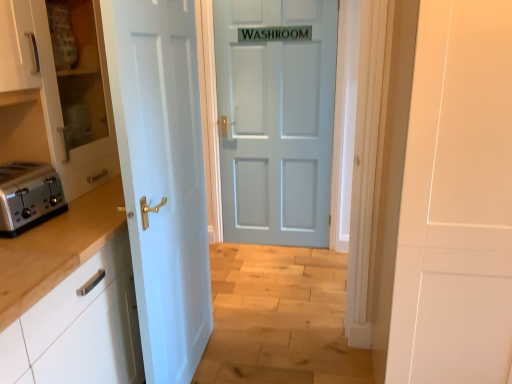
Question: Is white glossy cabinet at left, the first cabinetry in the top-to-bottom sequence, in front of white painted wood door at left, the 2th door viewed from the right?

Choices:
 (A) no
 (B) yes

Answer: (A)

Question: From the image's perspective, is white glossy cabinet at left, the first cabinetry in the top-to-bottom sequence, on top of white painted wood door at left, marked as the first door in a left-to-right arrangement?

Choices:
 (A) no
 (B) yes

Answer: (B)

Question: Considering the relative sizes of white glossy cabinet at left, the first cabinetry in the top-to-bottom sequence, and white painted wood door at left, positioned as the second door in back-to-front order, in the image provided, is white glossy cabinet at left, the first cabinetry in the top-to-bottom sequence, thinner than white painted wood door at left, positioned as the second door in back-to-front order,?

Choices:
 (A) no
 (B) yes

Answer: (A)

Question: Is white glossy cabinet at left, the first cabinetry in the top-to-bottom sequence, at the right side of white painted wood door at left, the 2th door viewed from the right?

Choices:
 (A) no
 (B) yes

Answer: (A)

Question: From a real-world perspective, is white glossy cabinet at left, the first cabinetry in the top-to-bottom sequence, physically below white painted wood door at left, the 2th door viewed from the right?

Choices:
 (A) no
 (B) yes

Answer: (A)

Question: From the image's perspective, relative to satin silver toaster at left, is white painted wood door at left, the 2th door viewed from the right, above or below?

Choices:
 (A) above
 (B) below

Answer: (B)

Question: From a real-world perspective, is white painted wood door at left, marked as the first door in a left-to-right arrangement, above or below satin silver toaster at left?

Choices:
 (A) above
 (B) below

Answer: (B)

Question: Would you say white painted wood door at left, positioned as the second door in back-to-front order, is inside or outside satin silver toaster at left?

Choices:
 (A) outside
 (B) inside

Answer: (A)

Question: Considering the relative positions of white painted wood door at left, marked as the first door in a left-to-right arrangement, and satin silver toaster at left in the image provided, is white painted wood door at left, marked as the first door in a left-to-right arrangement, to the left or to the right of satin silver toaster at left?

Choices:
 (A) right
 (B) left

Answer: (A)

Question: From a real-world perspective, relative to light blue matte door at center, placed as the second door when sorted from left to right, is white glossy cabinet at left, the first cabinetry in the top-to-bottom sequence, vertically above or below?

Choices:
 (A) below
 (B) above

Answer: (B)

Question: In terms of width, does white glossy cabinet at left, the first cabinetry in the top-to-bottom sequence, look wider or thinner when compared to light blue matte door at center, placed as the second door when sorted from left to right?

Choices:
 (A) wide
 (B) thin

Answer: (A)

Question: From the image's perspective, relative to light blue matte door at center, positioned as the 1th door in right-to-left order, is white glossy cabinet at left, the first cabinetry in the top-to-bottom sequence, above or below?

Choices:
 (A) above
 (B) below

Answer: (B)

Question: Looking at the image, does white glossy cabinet at left, which ranks as the 2th cabinetry in bottom-to-top order, seem bigger or smaller compared to light blue matte door at center, placed as the second door when sorted from left to right?

Choices:
 (A) small
 (B) big

Answer: (B)

Question: Is satin silver toaster at left bigger or smaller than white glossy cabinet at left, acting as the second cabinetry starting from the top?

Choices:
 (A) small
 (B) big

Answer: (A)

Question: Is satin silver toaster at left situated inside white glossy cabinet at left, the 1th cabinetry ordered from the bottom, or outside?

Choices:
 (A) outside
 (B) inside

Answer: (A)